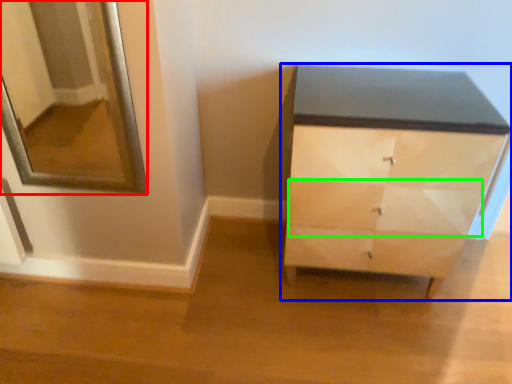
Question: Which object is the farthest from mirror (highlighted by a red box)? Choose among these: chest of drawers (highlighted by a blue box) or drawer (highlighted by a green box).

Choices:
 (A) chest of drawers
 (B) drawer

Answer: (B)